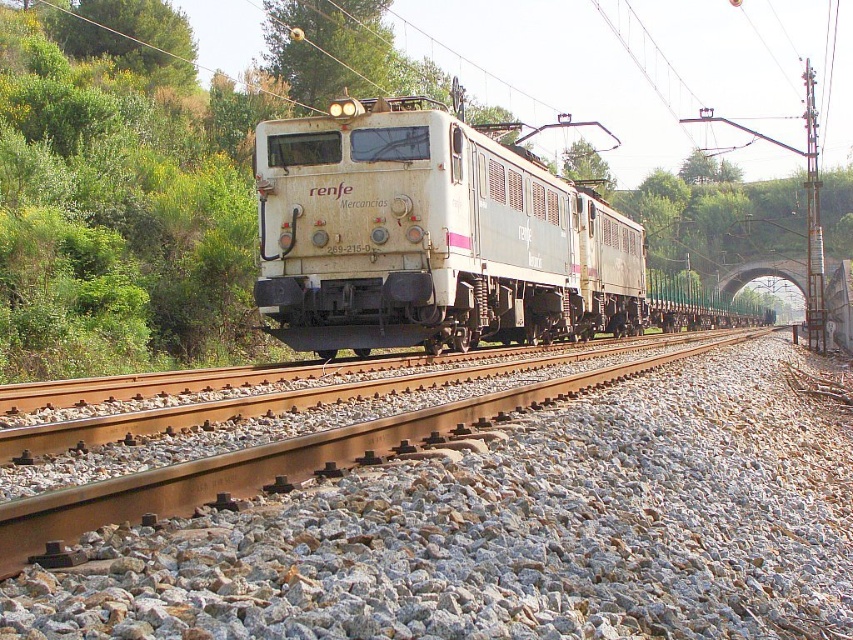
You are a railway inspector checking the train and its cargo. You notice the gray gravel at center and the white matte train at center. Which one has a lower height?

The gray gravel at center has a lesser height compared to the white matte train at center, so the gray gravel at center is lower in height.

You are a railway inspector checking the tracks. The gray gravel at center is crucial for maintaining track stability. Based on its position at point coordinates, is it properly placed between the tracks or alongside them?

The gray gravel at center is located at point coordinates, which places it between the tracks, ensuring proper stabilization.